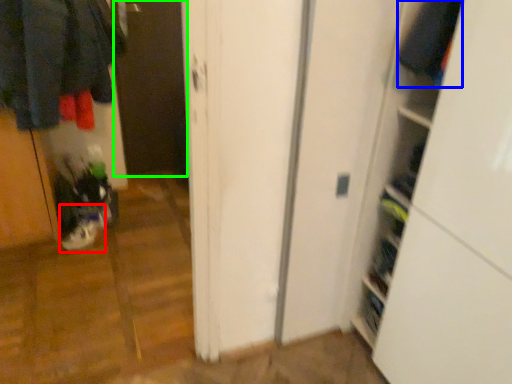
Question: Which object is positioned closest to footwear (highlighted by a red box)? Select from clothing (highlighted by a blue box) and screen door (highlighted by a green box).

Choices:
 (A) clothing
 (B) screen door

Answer: (B)